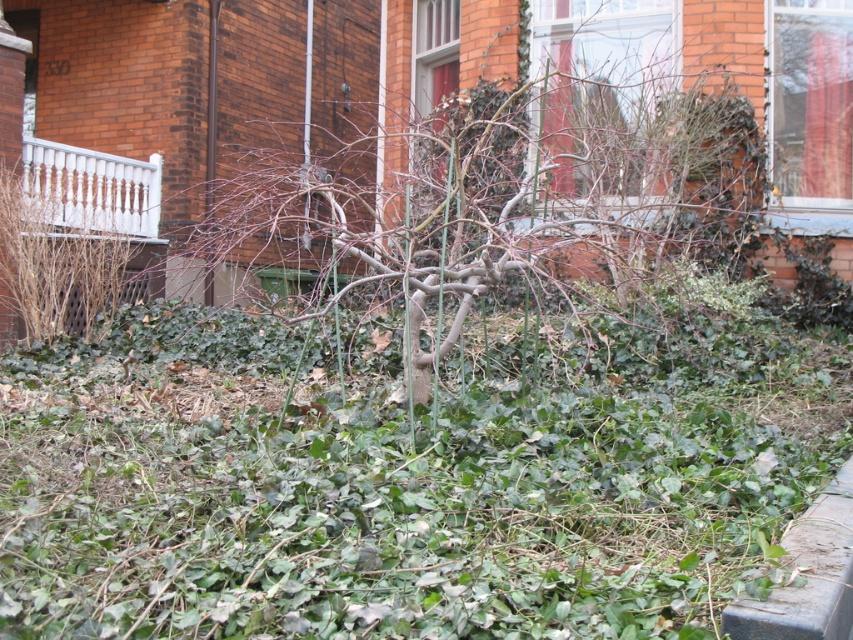
You are standing at the entrance of the brick building and want to place a small potted plant exactly at the center of the garden. The garden is represented by a coordinate system where the bottom left corner is the origin point. The coordinates of the green leafy grass at center are given. Where should you place the potted plant to ensure it is centered?

The green leafy grass at center is located at coordinates point [402,490]. To place the potted plant at the center of the garden, you should position it at the coordinates point [426,320] since the center of a coordinate system is typically at the midpoint values of 0.5 for both x and y axes.

You are a gardener assessing the garden in front of the brick building. You see the green leafy grass at center and the bare branches at center. Which of these two has a greater height?

The bare branches at center are taller than the green leafy grass at center.